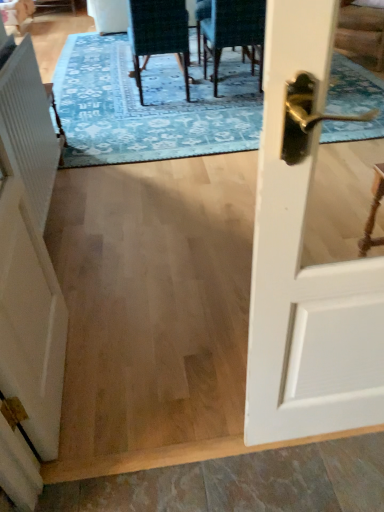
You are a GUI agent. You are given a task and a screenshot of the screen. Output one action in this format:
    pyautogui.click(x=<x>, y=<y>)
    Task: Click on the vacant space that is to the left of velvet dark green chair at center, the 2th chair viewed from the right
    
    Given the screenshot: What is the action you would take?
    pyautogui.click(x=106, y=102)